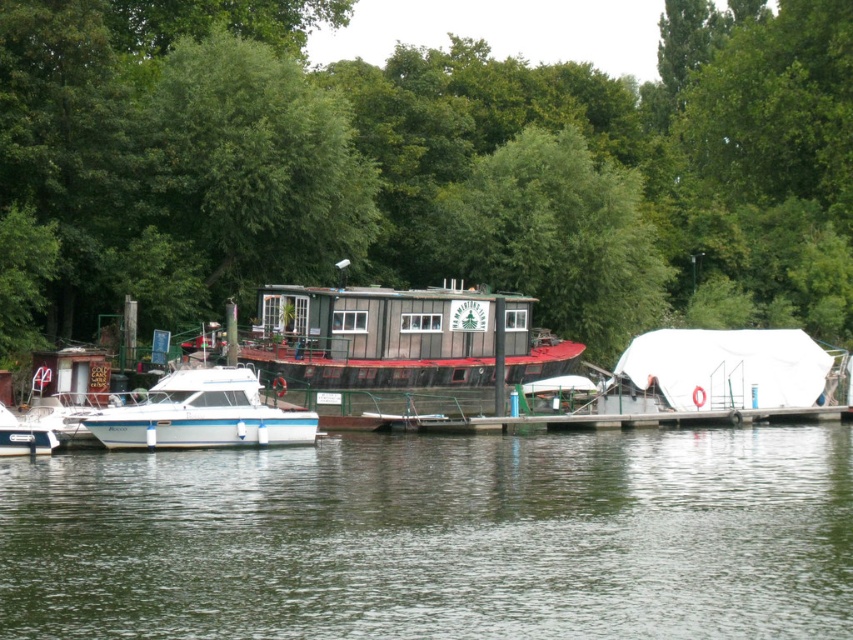
Question: Does white tarpaulin tent at right appear over white glossy boat at left?

Choices:
 (A) no
 (B) yes

Answer: (B)

Question: Is green leafy tree at upper center to the right of wooden cabin boat at center from the viewer's perspective?

Choices:
 (A) yes
 (B) no

Answer: (A)

Question: Is wooden cabin boat at center thinner than white glossy boat at left?

Choices:
 (A) yes
 (B) no

Answer: (B)

Question: Which object is the farthest from the white glossy boat at lower left?

Choices:
 (A) white tarpaulin tent at right
 (B) green leafy tree at upper center
 (C) white glossy boat at left
 (D) wooden cabin boat at center

Answer: (B)

Question: Which object is closer to the camera taking this photo?

Choices:
 (A) white glossy boat at lower left
 (B) green leafy tree at upper center
 (C) white tarpaulin tent at right
 (D) wooden cabin boat at center

Answer: (A)

Question: Which point is farther from the camera taking this photo?

Choices:
 (A) (111, 504)
 (B) (177, 376)
 (C) (3, 445)
 (D) (318, 301)

Answer: (D)